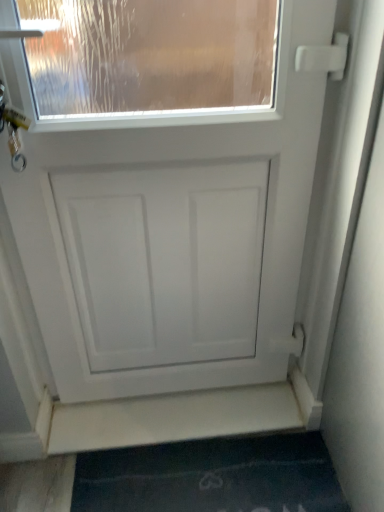
The height and width of the screenshot is (512, 384). I want to click on dark blue carpet at lower center, so click(x=211, y=477).

You are a GUI agent. You are given a task and a screenshot of the screen. Output one action in this format:
    pyautogui.click(x=<x>, y=<y>)
    Task: Click on the white matte stairwell at lower center
    Image resolution: width=384 pixels, height=512 pixels.
    Given the screenshot: What is the action you would take?
    pyautogui.click(x=185, y=416)

From a real-world perspective, who is located higher, dark blue carpet at lower center or white matte stairwell at lower center?

white matte stairwell at lower center.

Is dark blue carpet at lower center oriented towards white matte stairwell at lower center?

Yes, dark blue carpet at lower center is aimed at white matte stairwell at lower center.

Based on the photo, is dark blue carpet at lower center bigger than white matte stairwell at lower center?

Yes, dark blue carpet at lower center is bigger than white matte stairwell at lower center.

Is point (222, 465) in front of point (126, 445)?

Yes, point (222, 465) is closer to viewer.

Is white matte stairwell at lower center shorter than white matte door at center?

Yes, white matte stairwell at lower center is shorter than white matte door at center.

How many degrees apart are the facing directions of white matte stairwell at lower center and white matte door at center?

white matte stairwell at lower center and white matte door at center are facing 0.697 degrees away from each other.

Which object is further away from the camera taking this photo, white matte stairwell at lower center or white matte door at center?

white matte stairwell at lower center is more distant.

Choose the correct answer: Is white matte stairwell at lower center inside white matte door at center or outside it?

white matte stairwell at lower center is not enclosed by white matte door at center.

In the scene shown: Is there a large distance between white matte door at center and white matte stairwell at lower center?

No, white matte door at center is not far away from white matte stairwell at lower center.

The image size is (384, 512). In order to click on door that is on the left side of white matte stairwell at lower center in this screenshot , I will do `click(163, 184)`.

From a real-world perspective, does white matte door at center sit lower than white matte stairwell at lower center?

No, from a real-world perspective, white matte door at center is not below white matte stairwell at lower center.

Does point (214, 244) come farther from viewer compared to point (281, 416)?

No.

Which is more distant, (178, 475) or (168, 185)?

The point (178, 475) is farther from the camera.

Is dark blue carpet at lower center directly adjacent to white matte door at center?

dark blue carpet at lower center is not next to white matte door at center, and they're not touching.

What's the angular difference between dark blue carpet at lower center and white matte door at center's facing directions?

dark blue carpet at lower center and white matte door at center are facing 0.792 degrees away from each other.

Between dark blue carpet at lower center and white matte door at center, which one has less height?

With less height is dark blue carpet at lower center.

This screenshot has width=384, height=512. What are the coordinates of `bath mat below the white matte door at center (from a real-world perspective)` in the screenshot? It's located at (211, 477).

Is white matte door at center completely or partially outside of dark blue carpet at lower center?

Yes, white matte door at center is not within dark blue carpet at lower center.

Is white matte door at center touching dark blue carpet at lower center?

No, white matte door at center is not making contact with dark blue carpet at lower center.

Can you confirm if white matte door at center is shorter than dark blue carpet at lower center?

Incorrect, the height of white matte door at center does not fall short of that of dark blue carpet at lower center.

From the image's perspective, which object appears higher, white matte stairwell at lower center or dark blue carpet at lower center?

white matte stairwell at lower center is shown above in the image.

Would you consider white matte stairwell at lower center to be distant from dark blue carpet at lower center?

No, white matte stairwell at lower center is not far away from dark blue carpet at lower center.

Is white matte stairwell at lower center turned away from dark blue carpet at lower center?

No, white matte stairwell at lower center is not facing the opposite direction of dark blue carpet at lower center.

Relative to dark blue carpet at lower center, is white matte stairwell at lower center in front or behind?

Clearly, white matte stairwell at lower center is behind dark blue carpet at lower center.

Identify the location of bath mat that is under the white matte stairwell at lower center (from a real-world perspective). The width and height of the screenshot is (384, 512). click(x=211, y=477).

At what (x,y) coordinates should I click in order to perform the action: click on door on the left side of white matte stairwell at lower center. Please return your answer as a coordinate pair (x, y). The width and height of the screenshot is (384, 512). Looking at the image, I should click on (163, 184).

Which object lies nearer to the anchor point white matte stairwell at lower center, white matte door at center or dark blue carpet at lower center?

dark blue carpet at lower center lies closer to white matte stairwell at lower center than the other object.

When comparing their distances from white matte stairwell at lower center, does dark blue carpet at lower center or white matte door at center seem closer?

Based on the image, dark blue carpet at lower center appears to be nearer to white matte stairwell at lower center.

When comparing their distances from dark blue carpet at lower center, does white matte door at center or white matte stairwell at lower center seem further?

white matte door at center lies further to dark blue carpet at lower center than the other object.

Looking at this image, which object lies nearer to the anchor point white matte door at center, dark blue carpet at lower center or white matte stairwell at lower center?

white matte stairwell at lower center lies closer to white matte door at center than the other object.

Looking at the image, which one is located closer to dark blue carpet at lower center, white matte stairwell at lower center or white matte door at center?

white matte stairwell at lower center lies closer to dark blue carpet at lower center than the other object.

Looking at the image, which one is located further to white matte door at center, white matte stairwell at lower center or dark blue carpet at lower center?

The object further to white matte door at center is dark blue carpet at lower center.

Where is `stairwell between white matte door at center and dark blue carpet at lower center vertically`? This screenshot has height=512, width=384. stairwell between white matte door at center and dark blue carpet at lower center vertically is located at coordinates (185, 416).